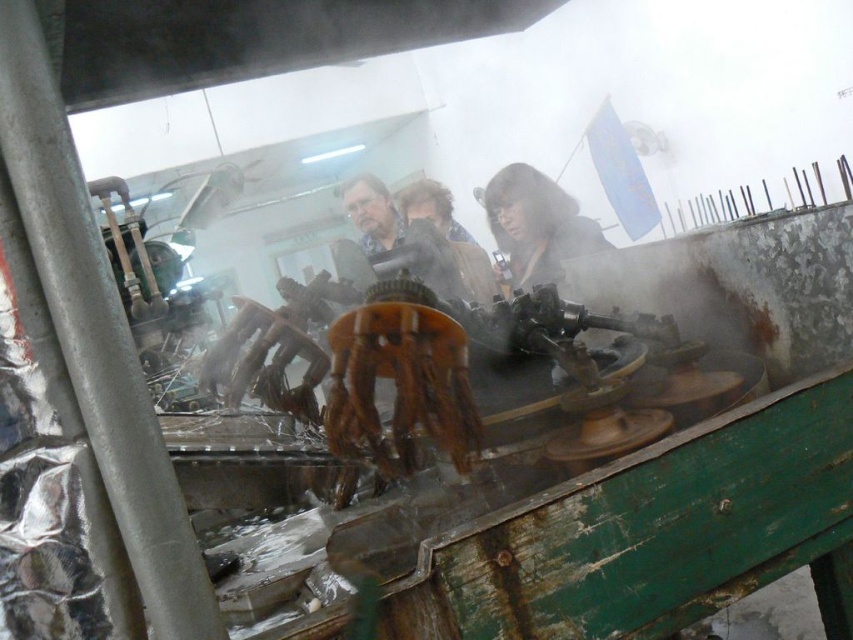
Question: Is dark brown leather jacket at center below brown leather jacket at center?

Choices:
 (A) no
 (B) yes

Answer: (B)

Question: Which point appears farthest from the camera in this image?

Choices:
 (A) (463, 237)
 (B) (532, 180)

Answer: (A)

Question: Can you confirm if dark brown leather jacket at center is bigger than brown leather jacket at center?

Choices:
 (A) no
 (B) yes

Answer: (B)

Question: Among these points, which one is nearest to the camera?

Choices:
 (A) (393, 221)
 (B) (521, 192)

Answer: (B)

Question: Can you confirm if dark brown leather jacket at center is positioned to the right of brown leather jacket at center?

Choices:
 (A) yes
 (B) no

Answer: (A)